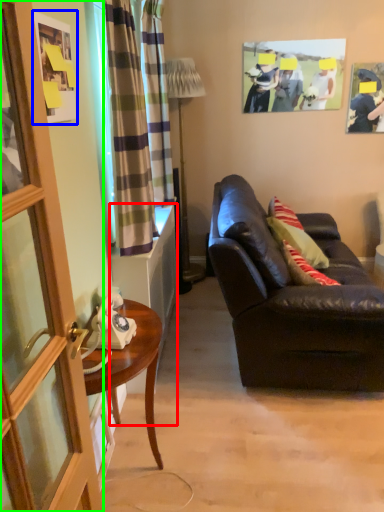
Question: Which is farther away from cabinetry (highlighted by a red box)? picture frame (highlighted by a blue box) or screen door (highlighted by a green box)?

Choices:
 (A) picture frame
 (B) screen door

Answer: (B)